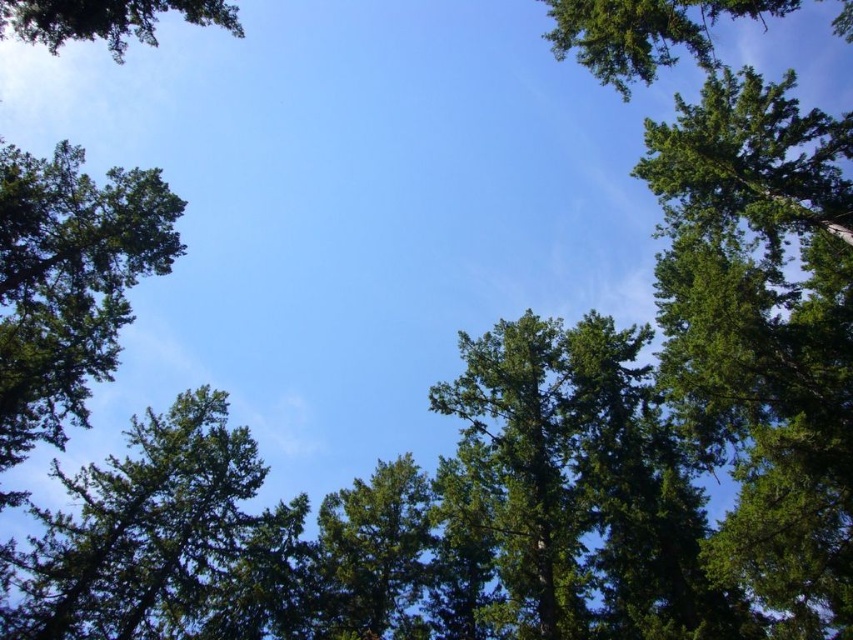
Who is positioned more to the right, green leafy tree at left or green leafy tree at upper right?

Positioned to the right is green leafy tree at upper right.

Who is shorter, green leafy tree at left or green leafy tree at upper right?

With less height is green leafy tree at left.

Does point (32, 321) lie in front of point (674, 35)?

No, (32, 321) is further to viewer.

Locate an element on the screen. The image size is (853, 640). green leafy tree at left is located at coordinates (68, 282).

Who is more distant from viewer, (196, 582) or (625, 72)?

The point (196, 582) is behind.

The image size is (853, 640). I want to click on green textured tree at lower left, so (158, 538).

Who is positioned more to the right, green textured tree at lower left or green leafy tree at center?

green leafy tree at center is more to the right.

Image resolution: width=853 pixels, height=640 pixels. Describe the element at coordinates (158, 538) in the screenshot. I see `green textured tree at lower left` at that location.

Is point (260, 563) positioned before point (372, 573)?

No, (260, 563) is further to viewer.

Where is `green textured tree at lower left`? This screenshot has width=853, height=640. green textured tree at lower left is located at coordinates (158, 538).